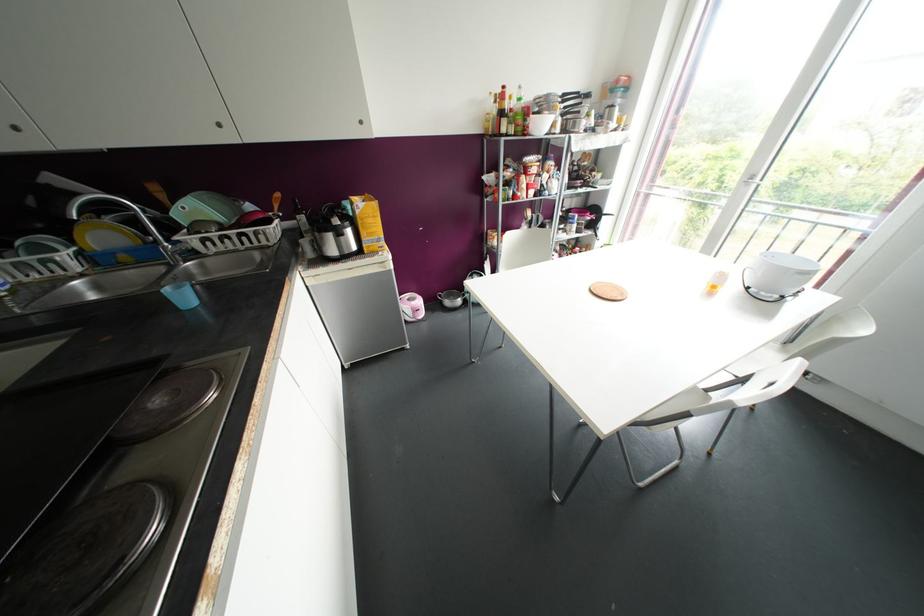
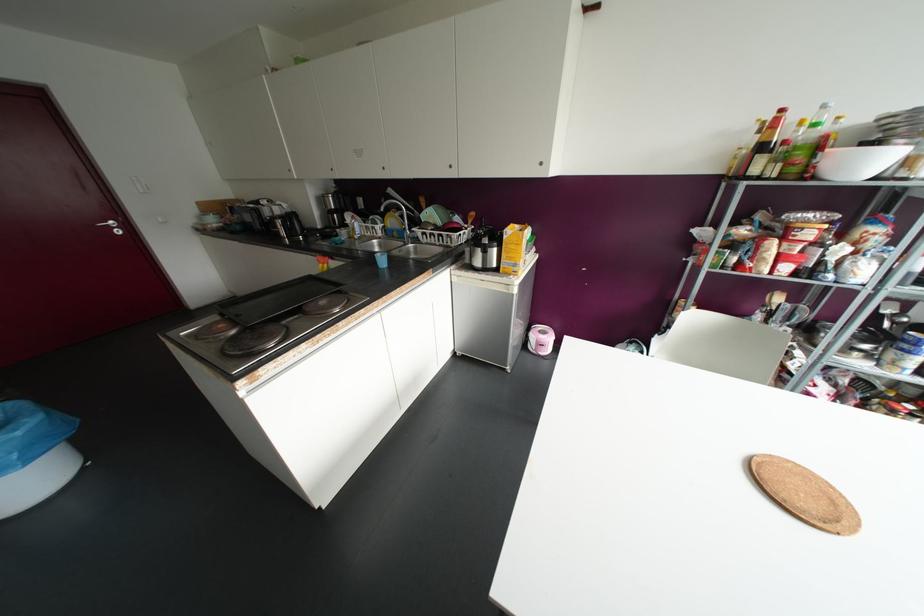
Question: The first image is from the beginning of the video and the second image is from the end. How did the camera likely rotate when shooting the video?

Choices:
 (A) Left
 (B) Right
 (C) Up
 (D) Down

Answer: (A)